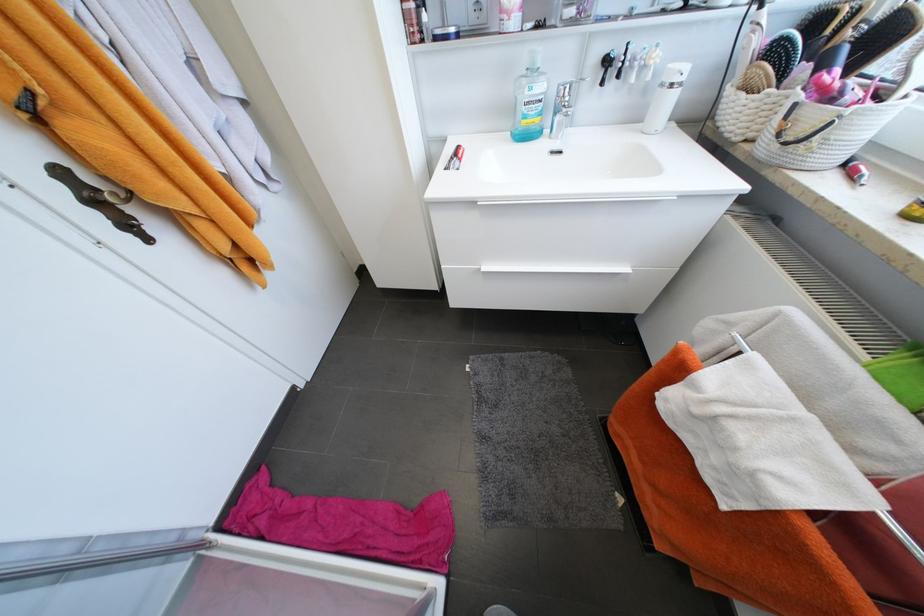
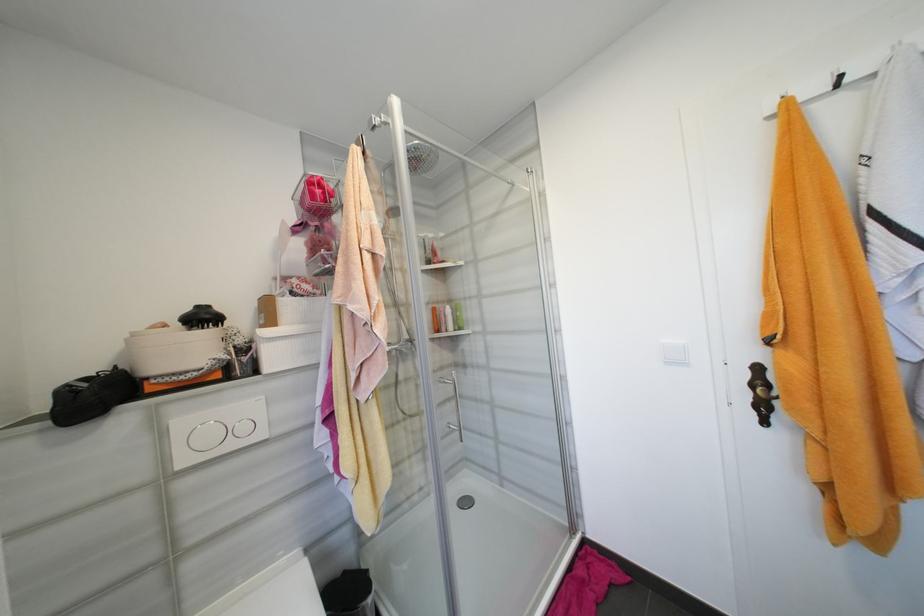
In the second image, find the point that corresponds to (x=67, y=174) in the first image.

(763, 370)